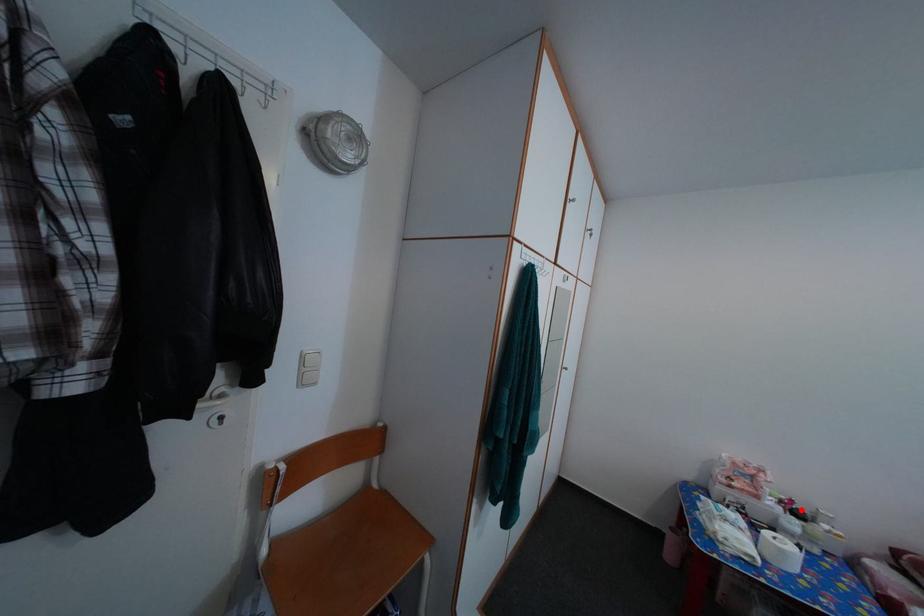
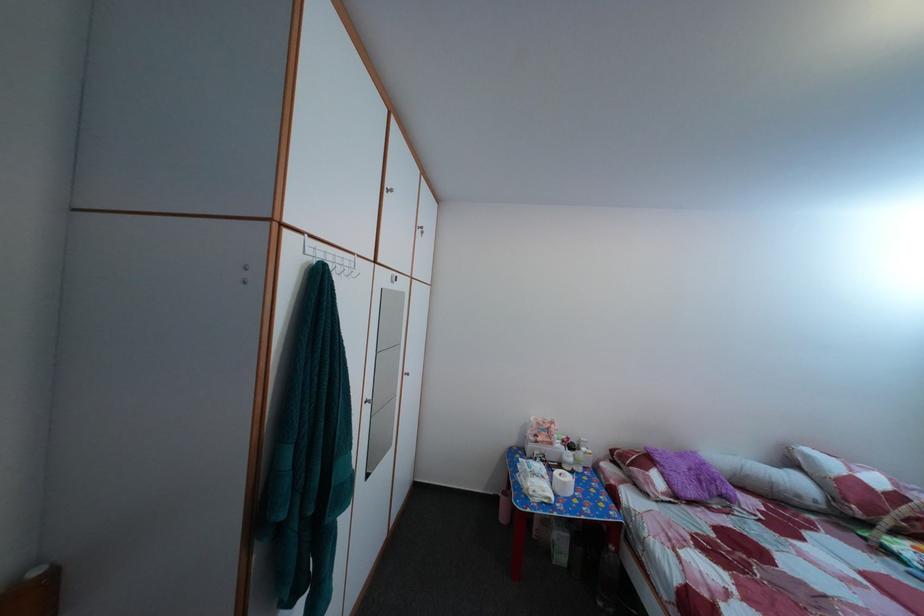
The point at the highlighted location is marked in the first image. Where is the corresponding point in the second image?

(578, 447)